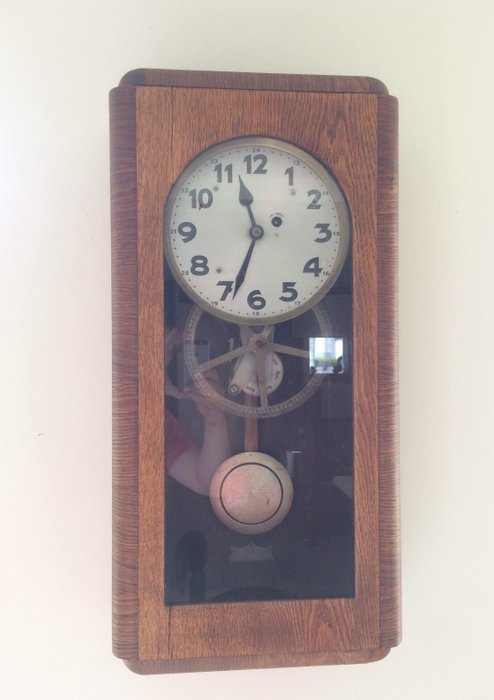
At what (x,y) coordinates should I click in order to perform the action: click on screw that attaches arms to clock face. Please return your answer as a coordinate pair (x, y). This screenshot has height=700, width=494. Looking at the image, I should click on (257, 232).